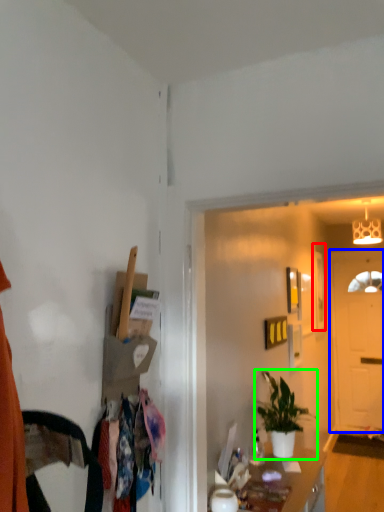
Question: Estimate the real-world distances between objects in this image. Which object is closer to picture frame (highlighted by a red box), door (highlighted by a blue box) or houseplant (highlighted by a green box)?

Choices:
 (A) door
 (B) houseplant

Answer: (A)